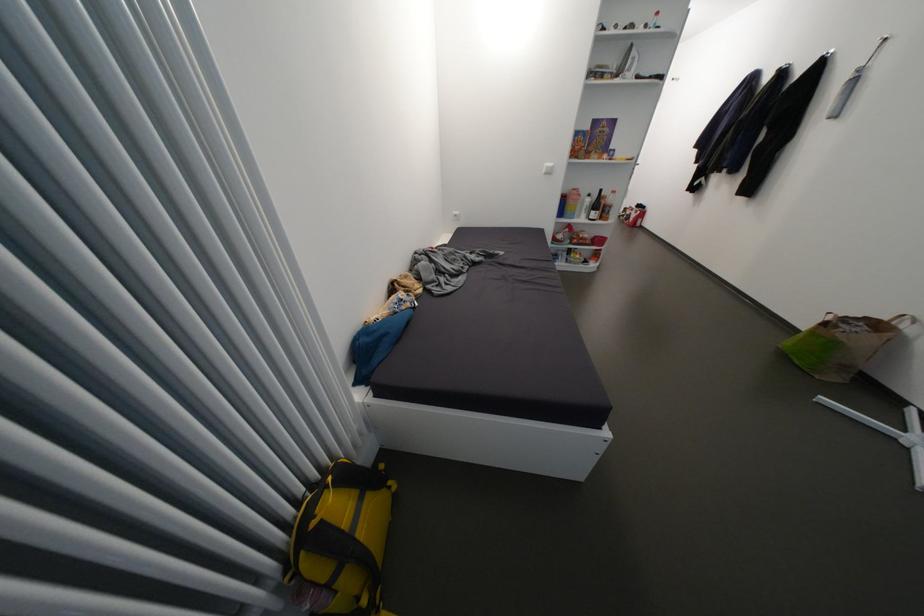
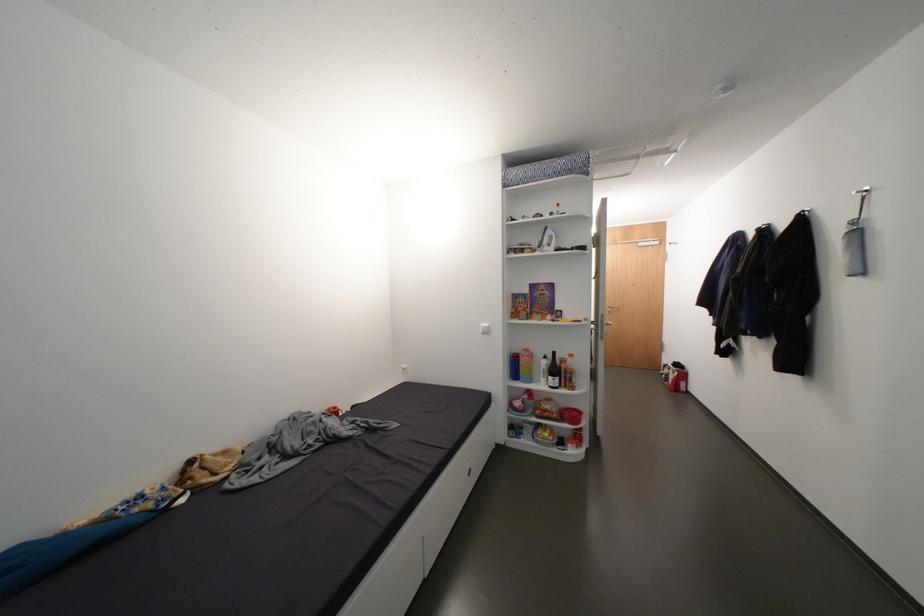
Find the pixel in the second image that matches (x=598, y=244) in the first image.

(566, 418)